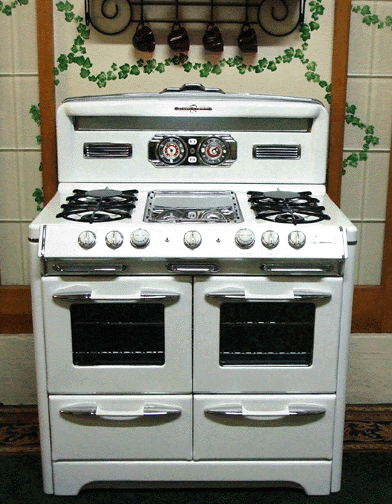
Identify the location of back right burner. Image resolution: width=392 pixels, height=504 pixels. (258, 196).